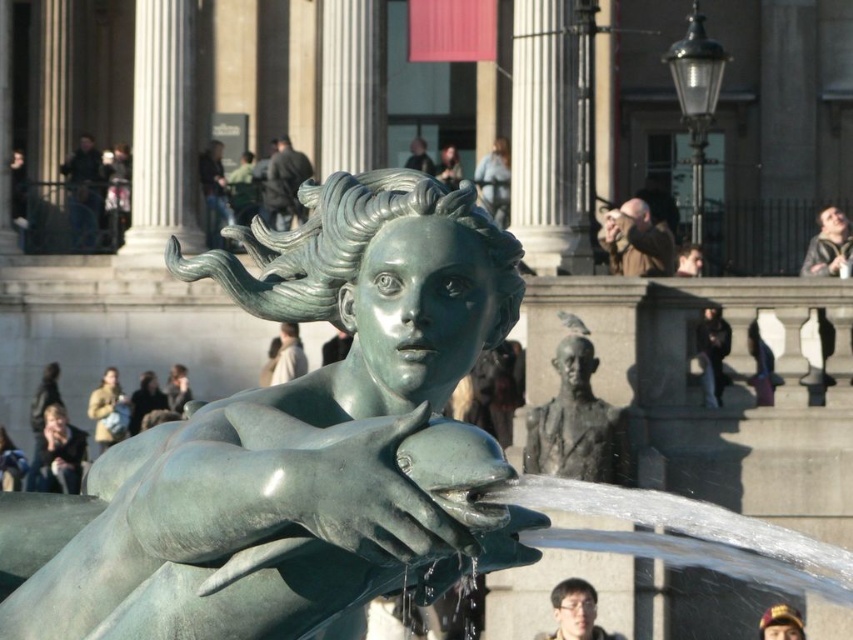
Between matte black glasses at lower center and matte black cap at lower right, which one appears on the right side from the viewer's perspective?

matte black cap at lower right is more to the right.

In the scene shown: Does matte black glasses at lower center lie in front of matte black cap at lower right?

That is True.

Image resolution: width=853 pixels, height=640 pixels. I want to click on matte black glasses at lower center, so click(x=575, y=612).

Is light brown hair at upper right thinner than light brown leather jacket at lower left?

In fact, light brown hair at upper right might be wider than light brown leather jacket at lower left.

The image size is (853, 640). What do you see at coordinates (828, 244) in the screenshot?
I see `light brown hair at upper right` at bounding box center [828, 244].

Based on the photo, who is more forward, (846, 218) or (112, 410)?

Point (112, 410)

You are a GUI agent. You are given a task and a screenshot of the screen. Output one action in this format:
    pyautogui.click(x=<x>, y=<y>)
    Task: Click on the light brown hair at upper right
    
    Given the screenshot: What is the action you would take?
    pyautogui.click(x=828, y=244)

Which is more to the right, green patina statue at center or light brown leather jacket at lower left?

green patina statue at center

The height and width of the screenshot is (640, 853). What are the coordinates of `green patina statue at center` in the screenshot? It's located at (299, 442).

Is point (399, 316) closer to camera compared to point (128, 403)?

Yes.

Find the location of `green patina statue at center`. green patina statue at center is located at coordinates (299, 442).